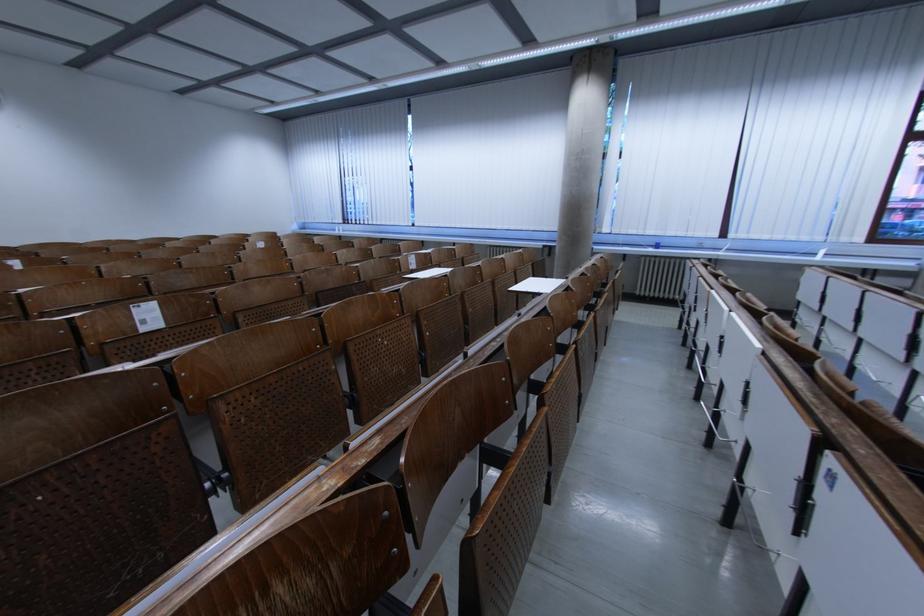
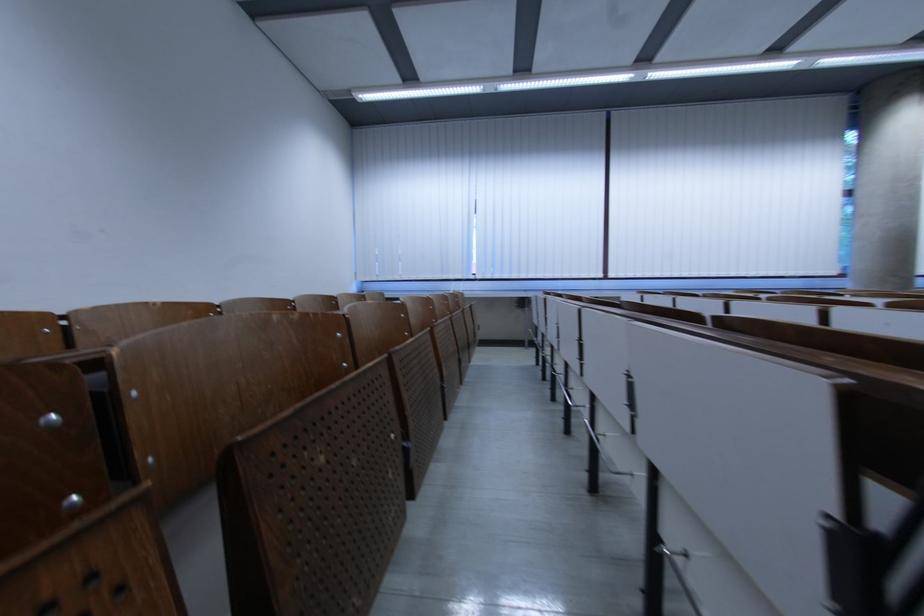
Locate, in the second image, the point that corresponds to point (259, 111) in the first image.

(354, 92)